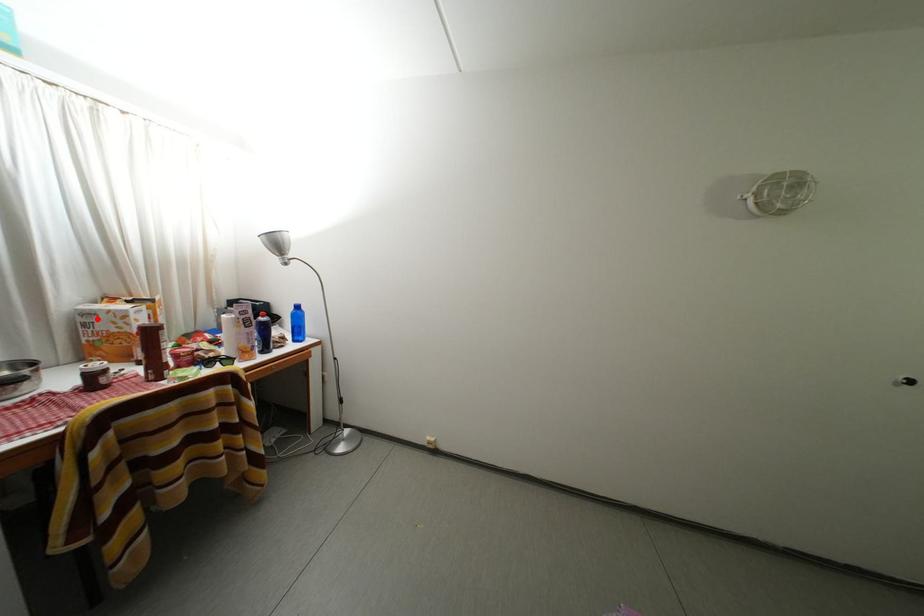
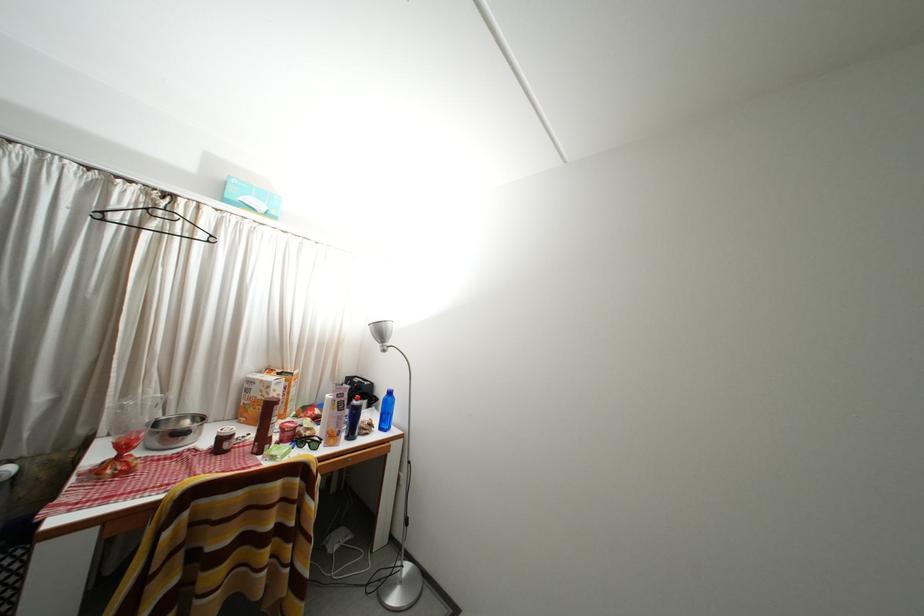
Locate, in the second image, the point that corresponds to the highlighted location in the first image.

(259, 387)